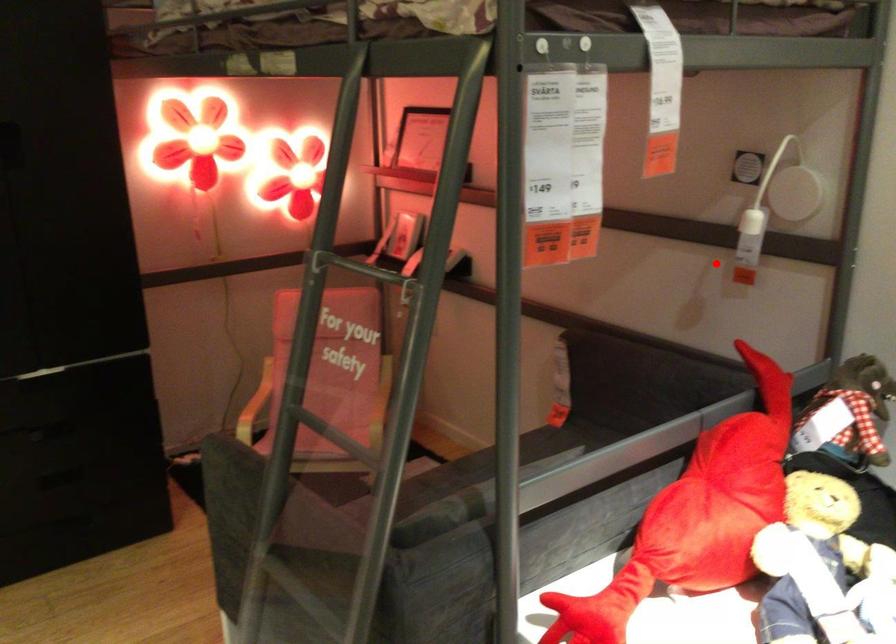
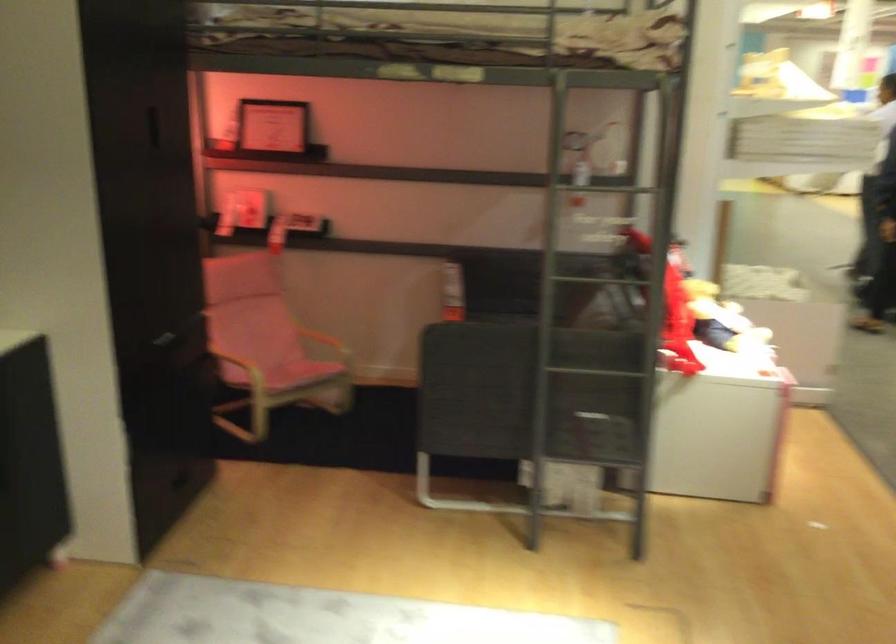
The point at the highlighted location is marked in the first image. Where is the corresponding point in the second image?

(591, 183)